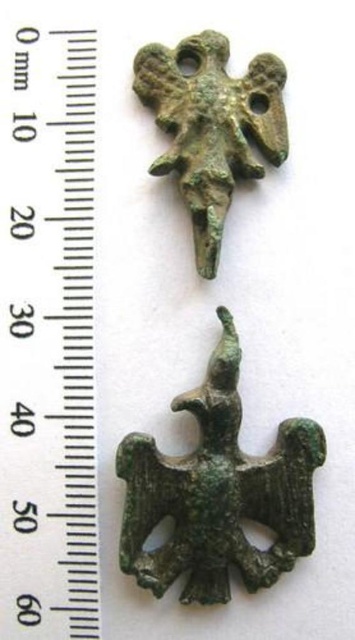
Question: From the image, what is the correct spatial relationship of metallic ruler at upper left in relation to green patina metal eagle at center?

Choices:
 (A) left
 (B) right

Answer: (A)

Question: Which point is farther to the camera?

Choices:
 (A) green bronze eagle at upper center
 (B) metallic ruler at upper left
 (C) green patina metal eagle at center

Answer: (A)

Question: Does metallic ruler at upper left have a lesser width compared to green patina metal eagle at center?

Choices:
 (A) yes
 (B) no

Answer: (A)

Question: Estimate the real-world distances between objects in this image. Which object is closer to the green bronze eagle at upper center?

Choices:
 (A) green patina metal eagle at center
 (B) metallic ruler at upper left

Answer: (B)

Question: Is green patina metal eagle at center to the left of green bronze eagle at upper center from the viewer's perspective?

Choices:
 (A) yes
 (B) no

Answer: (B)

Question: Which point is farther to the camera?

Choices:
 (A) green patina metal eagle at center
 (B) green bronze eagle at upper center
 (C) metallic ruler at upper left

Answer: (B)